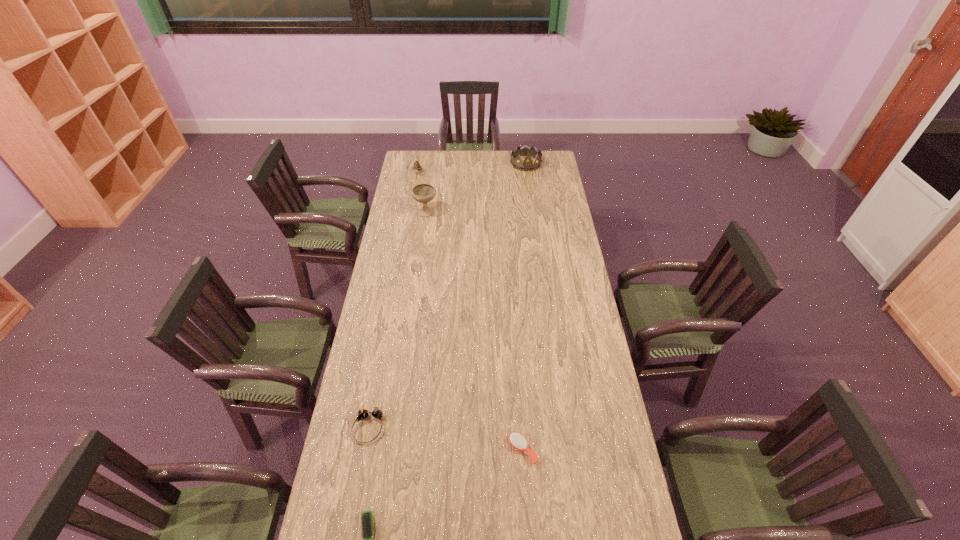
Locate an element on the screen. tiara that is at the far edge is located at coordinates 527,165.

I want to click on snail situated at the far edge, so click(417, 167).

Locate an element on the screen. The width and height of the screenshot is (960, 540). chalice located in the left edge section of the desktop is located at coordinates (423, 193).

Identify the location of snail present at the left edge. This screenshot has height=540, width=960. (417, 167).

This screenshot has width=960, height=540. I want to click on goggles present at the left edge, so click(363, 413).

Where is `object located at the right edge`? The width and height of the screenshot is (960, 540). object located at the right edge is located at coordinates (527, 165).

Locate an element on the screen. Image resolution: width=960 pixels, height=540 pixels. object at the far left corner is located at coordinates (417, 167).

What are the coordinates of `object present at the far right corner` in the screenshot? It's located at (527, 165).

In the image, there is a desktop. Where is `free space at the far edge`? Image resolution: width=960 pixels, height=540 pixels. free space at the far edge is located at coordinates (430, 171).

Identify the location of vacant space at the left edge of the desktop. The image size is (960, 540). (363, 398).